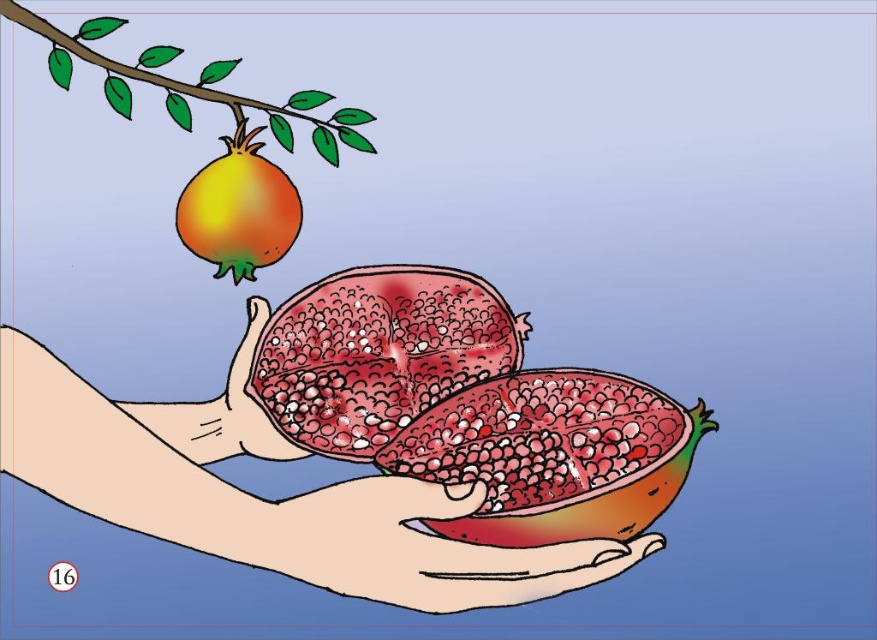
Who is taller, semi-glossy red pomegranate at center or shiny orange pomegranate at upper left?

semi-glossy red pomegranate at center

In the scene shown: Is semi-glossy red pomegranate at center to the right of shiny orange pomegranate at upper left from the viewer's perspective?

Yes, semi-glossy red pomegranate at center is to the right of shiny orange pomegranate at upper left.

Does point (319, 426) lie in front of point (267, 252)?

That is True.

Where is `semi-glossy red pomegranate at center`? semi-glossy red pomegranate at center is located at coordinates (376, 353).

Does point (354, 394) come closer to viewer compared to point (59, 65)?

Yes, it is.

Does point (498, 320) come behind point (247, 97)?

No, (498, 320) is in front of (247, 97).

Identify the location of semi-glossy red pomegranate at center. Image resolution: width=877 pixels, height=640 pixels. (376, 353).

Is point (372, 268) positioned after point (267, 451)?

Yes, it is behind point (267, 451).

Does semi-glossy red pomegranate at center appear on the right side of smooth skin hand at center?

Correct, you'll find semi-glossy red pomegranate at center to the right of smooth skin hand at center.

Identify the location of semi-glossy red pomegranate at center. (376, 353).

At what (x,y) coordinates should I click in order to perform the action: click on semi-glossy red pomegranate at center. Please return your answer as a coordinate pair (x, y). This screenshot has height=640, width=877. Looking at the image, I should click on (376, 353).